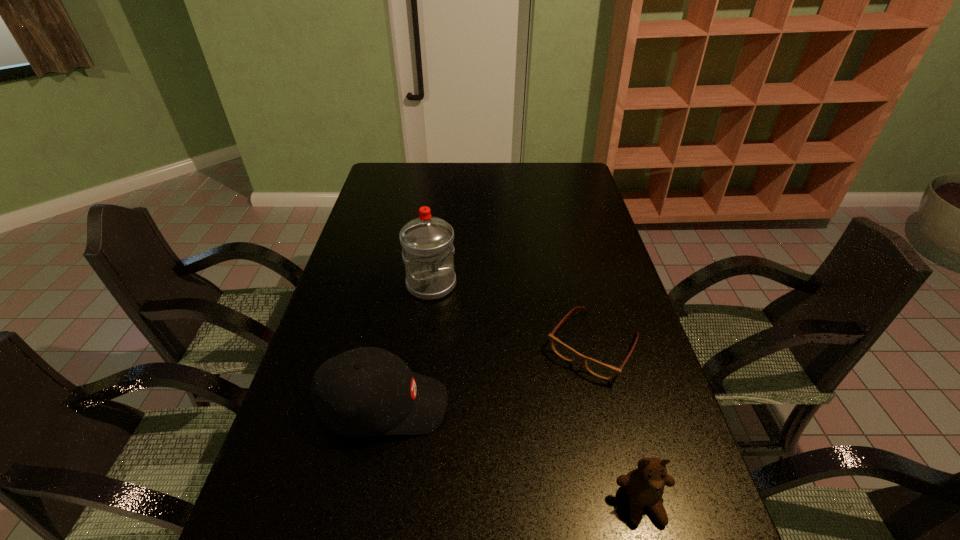
The image size is (960, 540). In order to click on vacant space on the desktop that is between the baseball cap and the teddy bear and is positioned on the handle side of the tallest object in this screenshot , I will do `click(510, 453)`.

What are the coordinates of `vacant space on the desktop that is between the baseball cap and the nearest object and is positioned on the front-facing side of the shortest object` in the screenshot? It's located at (516, 456).